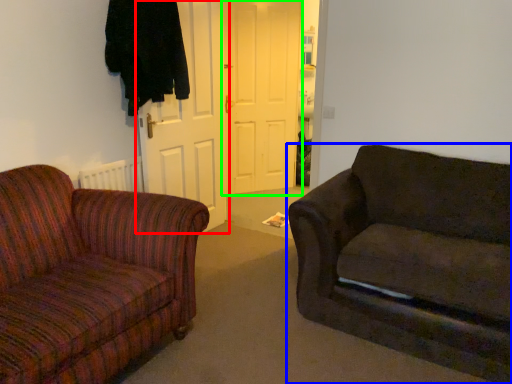
Question: Considering the real-world distances, which object is closest to door (highlighted by a red box)? studio couch (highlighted by a blue box) or door (highlighted by a green box).

Choices:
 (A) studio couch
 (B) door

Answer: (B)